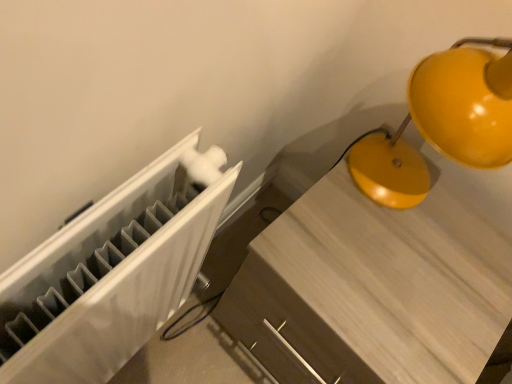
What do you see at coordinates (372, 291) in the screenshot?
I see `matte wood table at center` at bounding box center [372, 291].

Identify the location of matte wood table at center. The height and width of the screenshot is (384, 512). (372, 291).

Describe the element at coordinates (443, 123) in the screenshot. I see `matte yellow lamp at upper right` at that location.

At what (x,y) coordinates should I click in order to perform the action: click on matte yellow lamp at upper right. Please return your answer as a coordinate pair (x, y). Looking at the image, I should click on (443, 123).

In order to click on matte wood table at center in this screenshot , I will do `click(372, 291)`.

Which object is positioned more to the right, matte yellow lamp at upper right or matte wood table at center?

matte yellow lamp at upper right.

Is the position of matte yellow lamp at upper right less distant than that of matte wood table at center?

That is True.

Is point (426, 76) less distant than point (394, 222)?

Yes, it is.

From the image's perspective, is matte yellow lamp at upper right located above matte wood table at center?

Indeed, from the image's perspective, matte yellow lamp at upper right is shown above matte wood table at center.

From a real-world perspective, is matte yellow lamp at upper right on top of matte wood table at center?

Yes.

Considering the relative sizes of matte yellow lamp at upper right and matte wood table at center in the image provided, is matte yellow lamp at upper right thinner than matte wood table at center?

Correct, the width of matte yellow lamp at upper right is less than that of matte wood table at center.

Considering the relative sizes of matte yellow lamp at upper right and matte wood table at center in the image provided, is matte yellow lamp at upper right taller than matte wood table at center?

No.

Considering the relative sizes of matte yellow lamp at upper right and matte wood table at center in the image provided, is matte yellow lamp at upper right smaller than matte wood table at center?

Indeed, matte yellow lamp at upper right has a smaller size compared to matte wood table at center.

Is matte wood table at center surrounded by matte yellow lamp at upper right?

Actually, matte wood table at center is outside matte yellow lamp at upper right.

Is matte yellow lamp at upper right beside matte wood table at center?

matte yellow lamp at upper right is not next to matte wood table at center, and they're not touching.

Is matte wood table at center at the back of matte yellow lamp at upper right?

No, matte yellow lamp at upper right's orientation is not away from matte wood table at center.

What's the angular difference between matte yellow lamp at upper right and matte wood table at center's facing directions?

There is a 1-degree angle between the facing directions of matte yellow lamp at upper right and matte wood table at center.

Identify the location of lamp that is on the right side of matte wood table at center. (443, 123).

Considering the relative positions of matte wood table at center and matte yellow lamp at upper right in the image provided, is matte wood table at center to the left of matte yellow lamp at upper right from the viewer's perspective?

Yes, matte wood table at center is to the left of matte yellow lamp at upper right.

Which object is further away from the camera, matte wood table at center or matte yellow lamp at upper right?

matte wood table at center is more distant.

Is point (289, 354) in front of point (479, 145)?

That is False.

From the image's perspective, which is below, matte wood table at center or matte yellow lamp at upper right?

matte wood table at center is shown below in the image.

From a real-world perspective, who is located higher, matte wood table at center or matte yellow lamp at upper right?

From a 3D spatial view, matte yellow lamp at upper right is above.

In terms of width, does matte wood table at center look wider or thinner when compared to matte yellow lamp at upper right?

Considering their sizes, matte wood table at center looks broader than matte yellow lamp at upper right.

Considering the relative sizes of matte wood table at center and matte yellow lamp at upper right in the image provided, is matte wood table at center shorter than matte yellow lamp at upper right?

Incorrect, the height of matte wood table at center does not fall short of that of matte yellow lamp at upper right.

Is matte wood table at center smaller than matte yellow lamp at upper right?

Incorrect, matte wood table at center is not smaller in size than matte yellow lamp at upper right.

Is matte yellow lamp at upper right surrounded by matte wood table at center?

No, matte yellow lamp at upper right is located outside of matte wood table at center.

Looking at this image, would you say matte wood table at center is a long distance from matte yellow lamp at upper right?

That's not correct — matte wood table at center is a little close to matte yellow lamp at upper right.

Is matte wood table at center oriented towards matte yellow lamp at upper right?

No, matte wood table at center is not oriented towards matte yellow lamp at upper right.

Consider the image. What's the angular difference between matte wood table at center and matte yellow lamp at upper right's facing directions?

The facing directions of matte wood table at center and matte yellow lamp at upper right are 1 degrees apart.

Locate an element on the screen. The image size is (512, 384). lamp above the matte wood table at center (from a real-world perspective) is located at coordinates point(443,123).

Find the location of a particular element. lamp lying on the right of matte wood table at center is located at coordinates (443, 123).

Image resolution: width=512 pixels, height=384 pixels. In order to click on furniture behind the matte yellow lamp at upper right in this screenshot , I will do `click(372, 291)`.